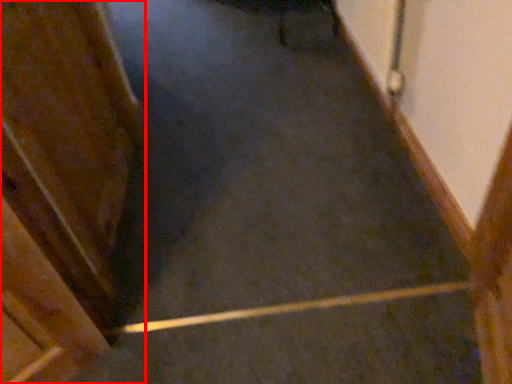
Question: From the image, what is the correct spatial relationship of door (annotated by the red box) in relation to stairs?

Choices:
 (A) right
 (B) left

Answer: (B)